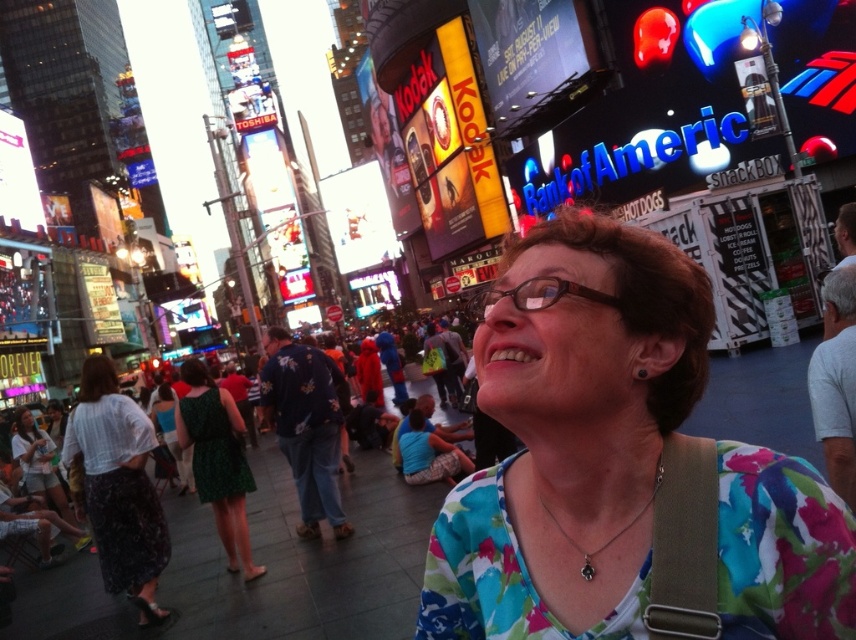
From the picture: You are a fashion designer observing an urban scene in Times Square. You notice the floral fabric blouse at center and the green dotted dress at center. Which clothing item appears taller in the image?

The floral fabric blouse at center is taller than the green dotted dress at center.

You are a photographer trying to capture a detailed shot of both the green dotted dress at center and the matte white shirt at lower left. Since you want both to be clearly visible, which one should you focus on first to ensure it doesn

The green dotted dress at center is bigger than the matte white shirt at lower left, so you should focus on the green dotted dress at center first to ensure it is in clear focus before adjusting for the smaller matte white shirt at lower left.